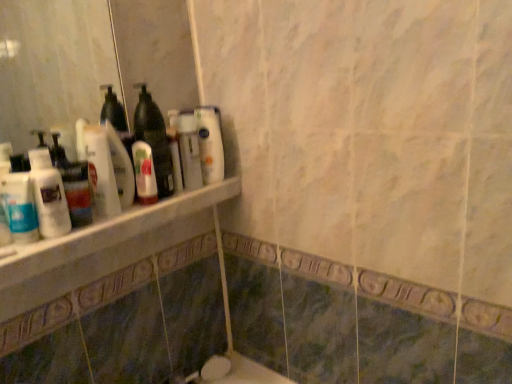
Question: Is white marble ledge at upper left further to the viewer compared to translucent plastic bottle at center?

Choices:
 (A) yes
 (B) no

Answer: (B)

Question: Is white marble ledge at upper left directly adjacent to translucent plastic bottle at center?

Choices:
 (A) yes
 (B) no

Answer: (B)

Question: From the image's perspective, is white marble ledge at upper left under translucent plastic bottle at center?

Choices:
 (A) no
 (B) yes

Answer: (B)

Question: Can you confirm if white marble ledge at upper left is shorter than translucent plastic bottle at center?

Choices:
 (A) yes
 (B) no

Answer: (A)

Question: Is white marble ledge at upper left taller than translucent plastic bottle at center?

Choices:
 (A) yes
 (B) no

Answer: (B)

Question: In terms of size, does white marble ledge at upper left appear bigger or smaller than translucent plastic bottle at left, which is the first cleaning product from front to back?

Choices:
 (A) big
 (B) small

Answer: (A)

Question: From the image's perspective, is white marble ledge at upper left located above or below translucent plastic bottle at left, acting as the 3th cleaning product starting from the right?

Choices:
 (A) below
 (B) above

Answer: (A)

Question: From their relative heights in the image, would you say white marble ledge at upper left is taller or shorter than translucent plastic bottle at left, which is the first cleaning product from front to back?

Choices:
 (A) tall
 (B) short

Answer: (B)

Question: In terms of width, does white marble ledge at upper left look wider or thinner when compared to translucent plastic bottle at left, the third cleaning product when ordered from back to front?

Choices:
 (A) thin
 (B) wide

Answer: (B)

Question: Visually, is translucent plastic bottle at center positioned to the left or to the right of translucent plastic mouthwash at shelf center, which appears as the second mouthwash when viewed from the left?

Choices:
 (A) left
 (B) right

Answer: (B)

Question: Considering the positions of point (173, 182) and point (154, 183), is point (173, 182) closer or farther from the camera than point (154, 183)?

Choices:
 (A) farther
 (B) closer

Answer: (A)

Question: Considering their positions, is translucent plastic bottle at center located in front of or behind translucent plastic mouthwash at shelf center, the 2th mouthwash in the front-to-back sequence?

Choices:
 (A) front
 (B) behind

Answer: (A)

Question: In terms of size, does translucent plastic bottle at center appear bigger or smaller than translucent plastic mouthwash at shelf center, which ranks as the 1th mouthwash in back-to-front order?

Choices:
 (A) small
 (B) big

Answer: (B)

Question: In terms of height, does white glossy bottles at upper left look taller or shorter compared to white marble ledge at upper left?

Choices:
 (A) tall
 (B) short

Answer: (A)

Question: Considering the relative positions of white glossy bottles at upper left and white marble ledge at upper left in the image provided, is white glossy bottles at upper left to the left or to the right of white marble ledge at upper left?

Choices:
 (A) left
 (B) right

Answer: (A)